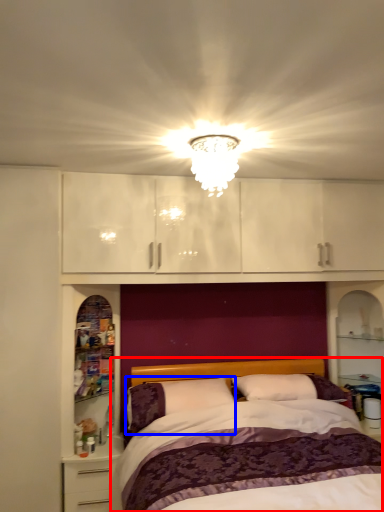
Question: Which point is closer to the camera, bed (highlighted by a red box) or pillow (highlighted by a blue box)?

Choices:
 (A) bed
 (B) pillow

Answer: (A)